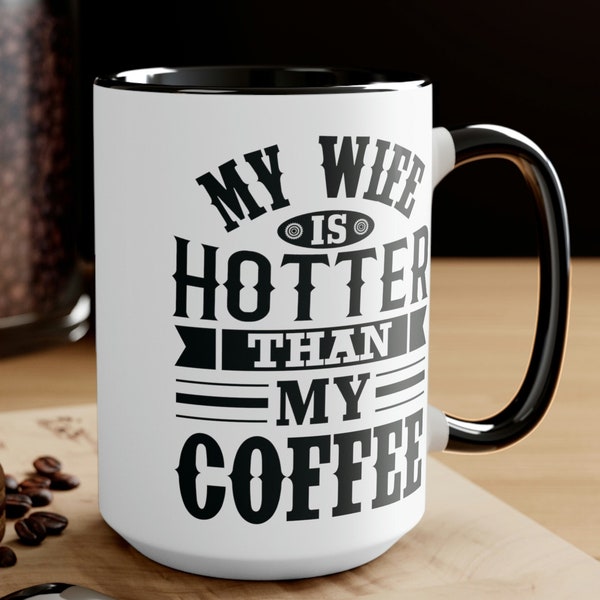
Image resolution: width=600 pixels, height=600 pixels. Find the location of `white mug`. white mug is located at coordinates (222, 127).